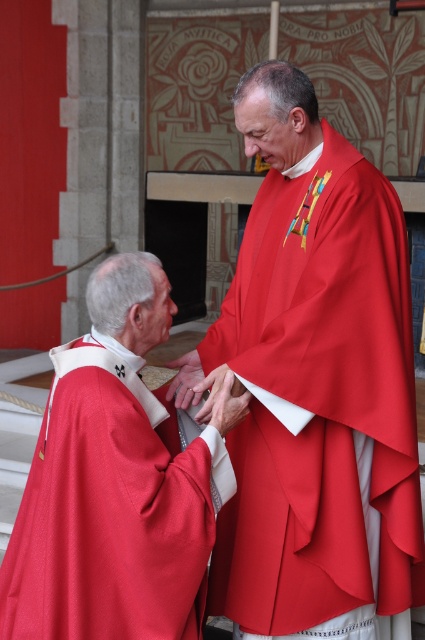
Question: Which of the following is the farthest from the observer?

Choices:
 (A) matte red cape at lower left
 (B) matte red robe at center

Answer: (B)

Question: Among these points, which one is nearest to the camera?

Choices:
 (A) (195, 636)
 (B) (269, 136)

Answer: (A)

Question: Can you confirm if matte red robe at center is positioned above matte red cape at lower left?

Choices:
 (A) no
 (B) yes

Answer: (B)

Question: Observing the image, what is the correct spatial positioning of matte red robe at center in reference to matte red cape at lower left?

Choices:
 (A) right
 (B) left

Answer: (A)

Question: Does matte red robe at center have a lesser width compared to matte red cape at lower left?

Choices:
 (A) no
 (B) yes

Answer: (A)

Question: Which of the following is the closest to the observer?

Choices:
 (A) (110, 572)
 (B) (314, 348)

Answer: (A)